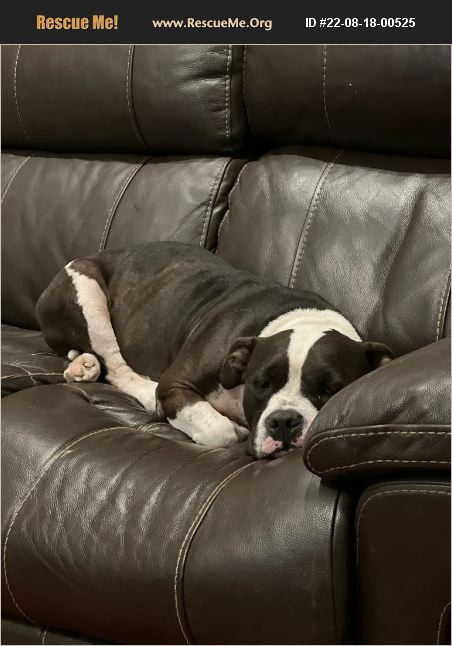
Where is `couch arm`? The image size is (452, 646). couch arm is located at coordinates (426, 521).